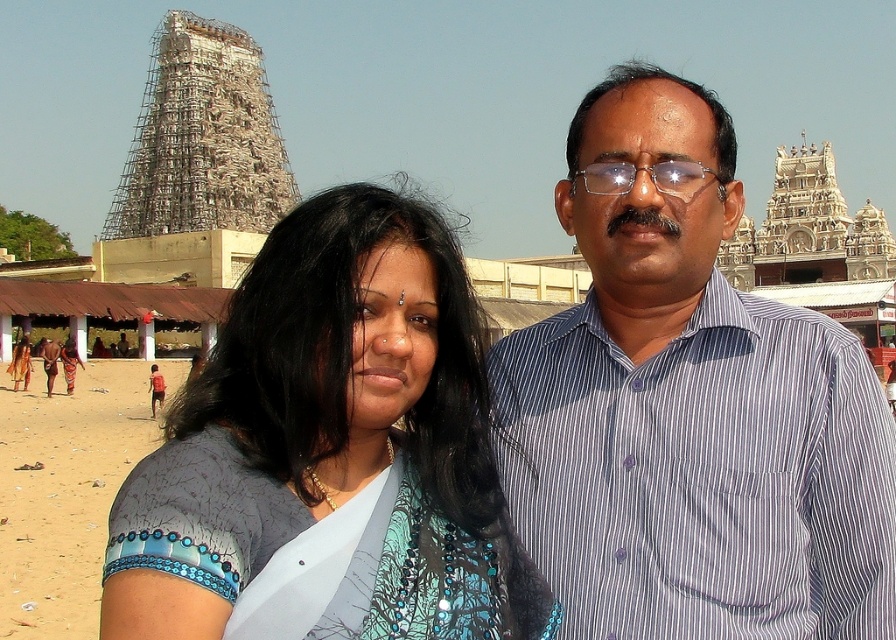
Question: Does blue printed saree at center appear on the left side of blue fabric at lower left?

Choices:
 (A) yes
 (B) no

Answer: (B)

Question: Can you confirm if blue striped shirt at center is wider than blue fabric at lower left?

Choices:
 (A) yes
 (B) no

Answer: (A)

Question: Observing the image, what is the correct spatial positioning of blue striped shirt at center in reference to blue fabric at lower left?

Choices:
 (A) right
 (B) left

Answer: (A)

Question: Which point is closer to the camera taking this photo?

Choices:
 (A) (132, 634)
 (B) (738, 387)

Answer: (A)

Question: Estimate the real-world distances between objects in this image. Which object is closer to the blue fabric at lower left?

Choices:
 (A) blue striped shirt at center
 (B) blue printed saree at center

Answer: (B)

Question: Which point appears closest to the camera in this image?

Choices:
 (A) (5, 628)
 (B) (497, 518)
 (C) (814, 636)

Answer: (C)